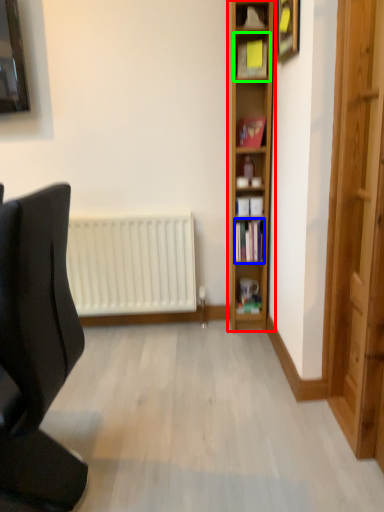
Question: Based on their relative distances, which object is farther from shelf (highlighted by a red box)? Choose from book (highlighted by a blue box) and shelf (highlighted by a green box).

Choices:
 (A) book
 (B) shelf

Answer: (B)